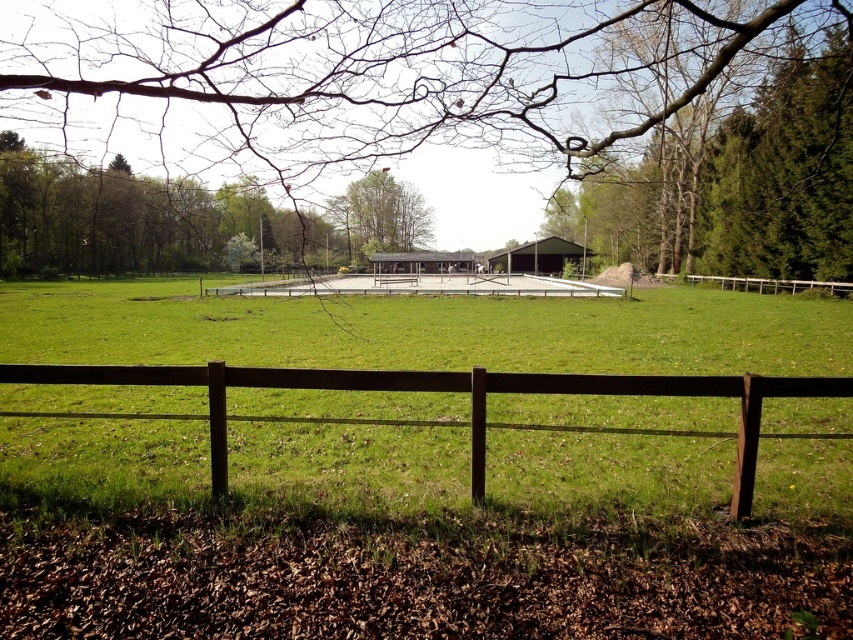
Question: Is green leafy tree at upper right to the left of brown wooden fence at right from the viewer's perspective?

Choices:
 (A) yes
 (B) no

Answer: (A)

Question: Estimate the real-world distances between objects in this image. Which object is closer to the brown wooden fence at right?

Choices:
 (A) green leafy tree at upper right
 (B) white concrete fence at center
 (C) green leafy tree at left
 (D) green leafy tree at center

Answer: (A)

Question: In this image, where is green matte barn at center located relative to brown wooden fence at right?

Choices:
 (A) above
 (B) below

Answer: (A)

Question: From the image, what is the correct spatial relationship of brown leafless branch at upper center in relation to white concrete fence at center?

Choices:
 (A) above
 (B) below

Answer: (A)

Question: Which object appears farthest from the camera in this image?

Choices:
 (A) brown wooden fence at right
 (B) green leafy tree at upper right
 (C) green matte barn at center

Answer: (C)

Question: Which of the following is the closest to the observer?

Choices:
 (A) (782, 289)
 (B) (833, 44)
 (C) (405, 193)

Answer: (B)